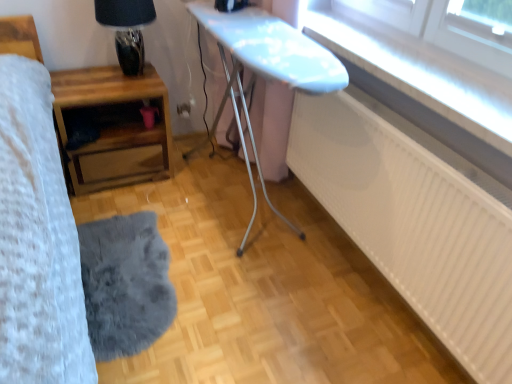
Question: Does transparent glass window at upper right have a larger size compared to matte glass table lamp at upper left?

Choices:
 (A) no
 (B) yes

Answer: (A)

Question: Is transparent glass window at upper right oriented towards matte glass table lamp at upper left?

Choices:
 (A) no
 (B) yes

Answer: (A)

Question: Is the depth of transparent glass window at upper right greater than that of matte glass table lamp at upper left?

Choices:
 (A) no
 (B) yes

Answer: (A)

Question: From a real-world perspective, is transparent glass window at upper right positioned over matte glass table lamp at upper left based on gravity?

Choices:
 (A) yes
 (B) no

Answer: (A)

Question: Does transparent glass window at upper right have a smaller size compared to matte glass table lamp at upper left?

Choices:
 (A) no
 (B) yes

Answer: (B)

Question: Is transparent glass window at upper right positioned far away from matte glass table lamp at upper left?

Choices:
 (A) yes
 (B) no

Answer: (A)

Question: Considering the relative positions of white matte radiator at lower right and transparent glass window at upper right in the image provided, is white matte radiator at lower right to the right of transparent glass window at upper right from the viewer's perspective?

Choices:
 (A) no
 (B) yes

Answer: (A)

Question: Does white matte radiator at lower right have a smaller size compared to transparent glass window at upper right?

Choices:
 (A) yes
 (B) no

Answer: (B)

Question: From the image's perspective, does white matte radiator at lower right appear higher than transparent glass window at upper right?

Choices:
 (A) yes
 (B) no

Answer: (B)

Question: From a real-world perspective, is white matte radiator at lower right positioned over transparent glass window at upper right based on gravity?

Choices:
 (A) yes
 (B) no

Answer: (B)

Question: Does white matte radiator at lower right have a greater height compared to transparent glass window at upper right?

Choices:
 (A) no
 (B) yes

Answer: (B)

Question: Is white matte radiator at lower right turned away from transparent glass window at upper right?

Choices:
 (A) yes
 (B) no

Answer: (B)

Question: Does wooden nightstand at left, which appears as the first table when viewed from the left, have a greater width compared to transparent glass window at upper right?

Choices:
 (A) no
 (B) yes

Answer: (B)